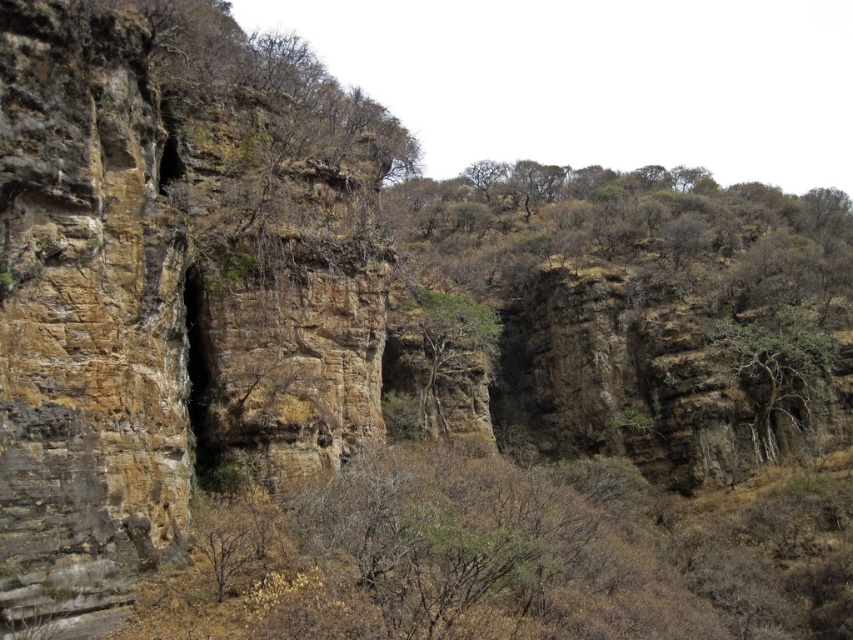
Is green leafy tree at center in front of brown textured tree at center?

Yes, it is.

Is point (437, 426) farther from camera compared to point (753, 321)?

No, (437, 426) is in front of (753, 321).

Which is behind, point (440, 320) or point (781, 307)?

The point (781, 307) is behind.

Locate an element on the screen. Image resolution: width=853 pixels, height=640 pixels. green leafy tree at center is located at coordinates (440, 358).